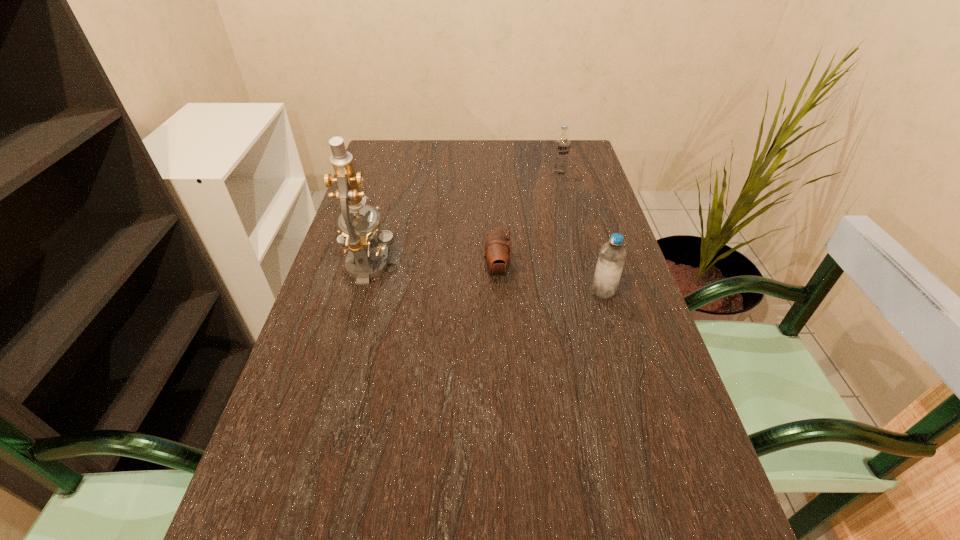
Find the location of a particular element. The width and height of the screenshot is (960, 540). vacant space that is in between the vodka and the water bottle is located at coordinates (581, 233).

Identify which object is the third closest to the third object from right to left. Please provide its 2D coordinates. Your answer should be formatted as a tuple, i.e. [(x, y)], where the tuple contains the x and y coordinates of a point satisfying the conditions above.

[(562, 143)]

Point out which object is positioned as the third nearest to the second object from left to right. Please provide its 2D coordinates. Your answer should be formatted as a tuple, i.e. [(x, y)], where the tuple contains the x and y coordinates of a point satisfying the conditions above.

[(562, 143)]

The height and width of the screenshot is (540, 960). In order to click on free space that satisfies the following two spatial constraints: 1. on the front side of the water bottle; 2. on the left side of the tallest object in this screenshot , I will do `click(363, 292)`.

Locate an element on the screen. The image size is (960, 540). free space that satisfies the following two spatial constraints: 1. on the front label of the vodka; 2. on the right side of the water bottle is located at coordinates (588, 292).

Locate an element on the screen. vacant space that satisfies the following two spatial constraints: 1. with the flap open on the shortest object; 2. on the back side of the water bottle is located at coordinates (497, 292).

Where is `vacant space that satisfies the following two spatial constraints: 1. on the front label of the farthest object; 2. with the flap open on the third object from right to left`? This screenshot has width=960, height=540. vacant space that satisfies the following two spatial constraints: 1. on the front label of the farthest object; 2. with the flap open on the third object from right to left is located at coordinates (583, 271).

Identify the location of free space that satisfies the following two spatial constraints: 1. with the flap open on the shortest object; 2. on the right side of the water bottle. The width and height of the screenshot is (960, 540). (497, 292).